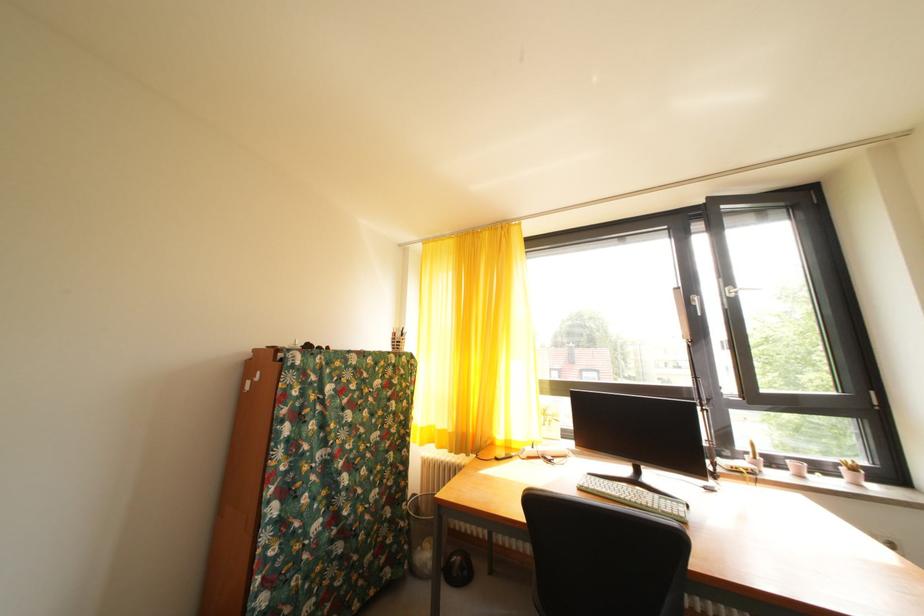
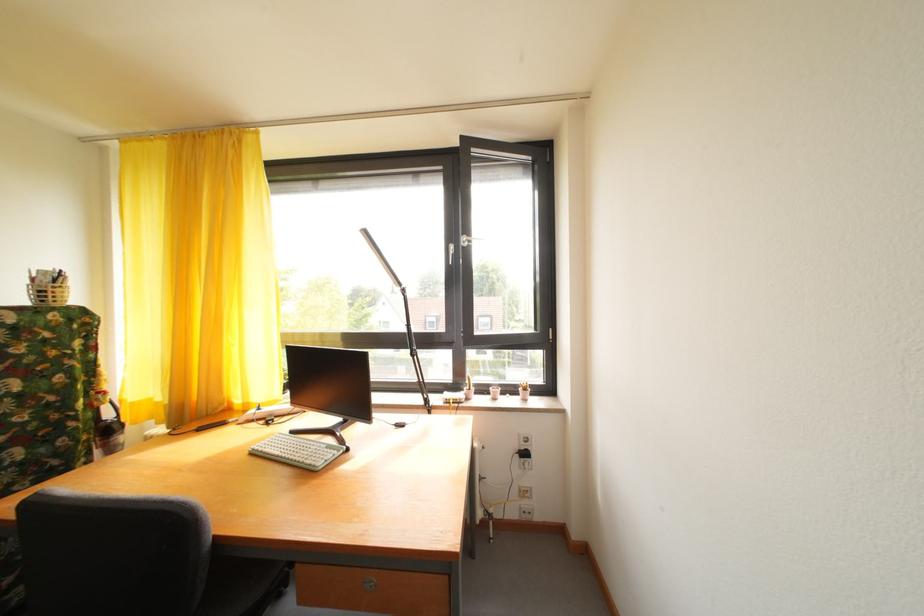
The point at (403, 339) is marked in the first image. Where is the corresponding point in the second image?

(43, 286)